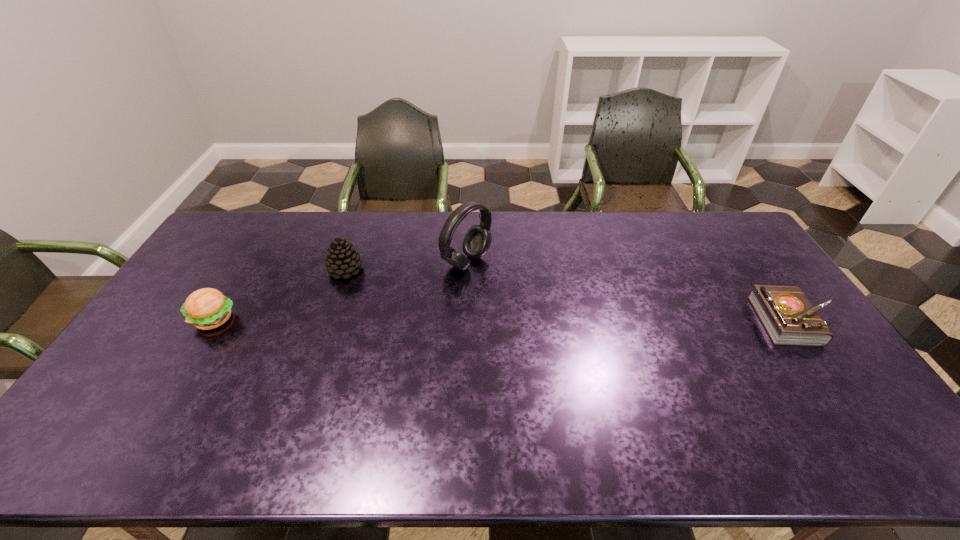
The width and height of the screenshot is (960, 540). Find the location of `vacant spot on the desktop that is between the leftmost object and the diary and is positioned at the narrow end of the pinecone`. vacant spot on the desktop that is between the leftmost object and the diary and is positioned at the narrow end of the pinecone is located at coordinates [x=441, y=320].

Image resolution: width=960 pixels, height=540 pixels. In order to click on vacant space on the desktop that is between the leftmost object and the shortest object and is positioned on the earcups of the third object from left to right in this screenshot , I will do `click(575, 320)`.